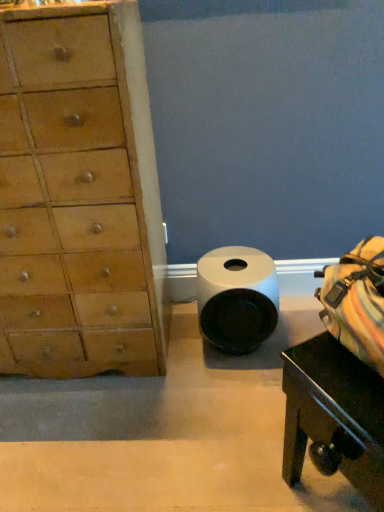
In order to click on vacant space in front of light brown wood chest of drawers at left in this screenshot , I will do `click(86, 436)`.